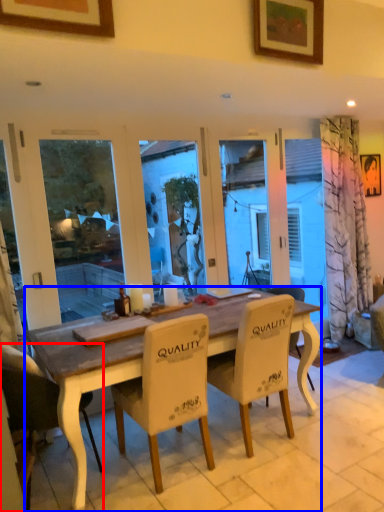
Question: Which object appears farthest to the camera in this image, chair (highlighted by a red box) or desk (highlighted by a blue box)?

Choices:
 (A) chair
 (B) desk

Answer: (A)